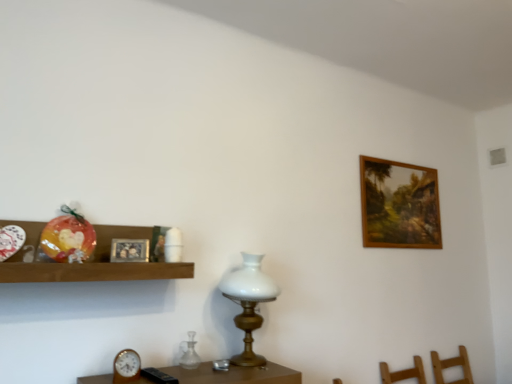
Question: Does silver metallic picture frame at upper left, placed as the 1th picture frame when sorted from front to back, have a greater width compared to wooden framed painting at upper right, positioned as the second picture frame in front-to-back order?

Choices:
 (A) yes
 (B) no

Answer: (B)

Question: Would you say wooden framed painting at upper right, positioned as the second picture frame in front-to-back order, is part of silver metallic picture frame at upper left, the second picture frame viewed from the right,'s contents?

Choices:
 (A) no
 (B) yes

Answer: (A)

Question: Is silver metallic picture frame at upper left, the second picture frame from the back, located outside wooden framed painting at upper right, positioned as the second picture frame in front-to-back order?

Choices:
 (A) no
 (B) yes

Answer: (B)

Question: Can you confirm if silver metallic picture frame at upper left, acting as the first picture frame starting from the left, is positioned to the left of wooden framed painting at upper right, which is the first picture frame in back-to-front order?

Choices:
 (A) yes
 (B) no

Answer: (A)

Question: Does silver metallic picture frame at upper left, the second picture frame from the back, have a greater height compared to wooden framed painting at upper right, the second picture frame in the left-to-right sequence?

Choices:
 (A) no
 (B) yes

Answer: (A)

Question: Is silver metallic picture frame at upper left, acting as the first picture frame starting from the left, positioned with its back to wooden framed painting at upper right, positioned as the second picture frame in front-to-back order?

Choices:
 (A) no
 (B) yes

Answer: (A)

Question: Is white glass table lamp at center closer to the viewer compared to wooden shelf at left?

Choices:
 (A) yes
 (B) no

Answer: (B)

Question: From a real-world perspective, is white glass table lamp at center physically above wooden shelf at left?

Choices:
 (A) no
 (B) yes

Answer: (A)

Question: Can you confirm if white glass table lamp at center is wider than wooden shelf at left?

Choices:
 (A) yes
 (B) no

Answer: (A)

Question: Is white glass table lamp at center completely or partially outside of wooden shelf at left?

Choices:
 (A) yes
 (B) no

Answer: (A)

Question: Does white glass table lamp at center come behind wooden shelf at left?

Choices:
 (A) yes
 (B) no

Answer: (A)

Question: From the image's perspective, would you say white glass table lamp at center is positioned over wooden shelf at left?

Choices:
 (A) yes
 (B) no

Answer: (B)

Question: Can you confirm if transparent glass vase at center is bigger than wooden clock at lower left?

Choices:
 (A) yes
 (B) no

Answer: (A)